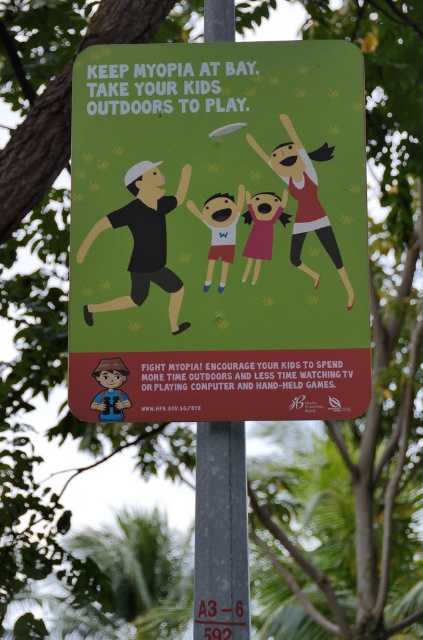
You are standing in front of the green informational sign and looking at it. There are two points marked on the sign. The first point is at coordinate point (246, 568) and the second is at point (297, 218). Which point appears closer to you?

Point (246, 568) is closer to the camera than point (297, 218), so the first point appears closer to you.

What is the position of point (143, 241) in the image?

The point is on the black matte figure at center.

You are a parent holding a green matte poster at center and a pink paper child at center. You want to place them on a shelf so that the child can see the poster clearly. Which object should be placed higher on the shelf?

The green matte poster at center should be placed higher on the shelf than the pink paper child at center because the poster is positioned over the child in the image, indicating it should be above to maintain visibility.